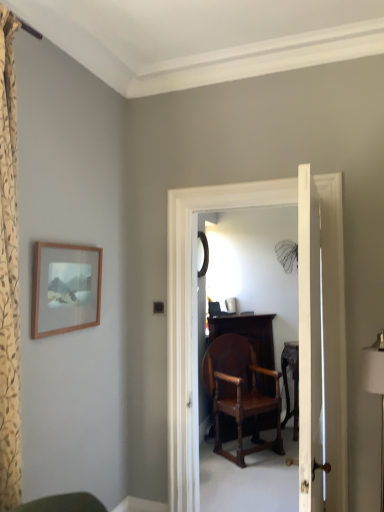
What do you see at coordinates (375, 386) in the screenshot? I see `white fabric lampshade at right` at bounding box center [375, 386].

The image size is (384, 512). Describe the element at coordinates (294, 383) in the screenshot. I see `wooden carved table at center` at that location.

What do you see at coordinates (204, 254) in the screenshot? I see `black glass mirror at center` at bounding box center [204, 254].

You are a GUI agent. You are given a task and a screenshot of the screen. Output one action in this format:
    pyautogui.click(x=<x>, y=<y>)
    Task: Click on the wooden picture frame at upper left
    Image resolution: width=384 pixels, height=512 pixels.
    Given the screenshot: What is the action you would take?
    pyautogui.click(x=65, y=288)

The height and width of the screenshot is (512, 384). I want to click on chair above the wooden carved table at center (from a real-world perspective), so click(241, 395).

Is wooden carved table at center taller than mahogany wood chair at center?

In fact, wooden carved table at center may be shorter than mahogany wood chair at center.

From a real-world perspective, is wooden carved table at center physically below mahogany wood chair at center?

Yes, from a real-world perspective, wooden carved table at center is under mahogany wood chair at center.

Would you say wooden carved table at center is to the left or to the right of mahogany wood chair at center in the picture?

In the image, wooden carved table at center appears on the right side of mahogany wood chair at center.

This screenshot has width=384, height=512. In the image, there is a mahogany wood chair at center. In order to click on table lamp above it (from the image's perspective) in this screenshot , I will do `click(375, 386)`.

Is point (271, 441) positioned in front of point (376, 376)?

That is False.

Considering the relative sizes of mahogany wood chair at center and white fabric lampshade at right in the image provided, is mahogany wood chair at center taller than white fabric lampshade at right?

Yes.

Is mahogany wood chair at center bigger than white fabric lampshade at right?

Indeed, mahogany wood chair at center has a larger size compared to white fabric lampshade at right.

Based on the photo, is white fabric lampshade at right smaller than wooden carved table at center?

Indeed, white fabric lampshade at right has a smaller size compared to wooden carved table at center.

Is wooden carved table at center at the back of white fabric lampshade at right?

No, wooden carved table at center is not at the back of white fabric lampshade at right.

From the image's perspective, which object appears higher, white fabric lampshade at right or wooden carved table at center?

white fabric lampshade at right is shown above in the image.

From a real-world perspective, is white fabric lampshade at right on wooden carved table at center?

Indeed, from a real-world perspective, white fabric lampshade at right stands above wooden carved table at center.

From a real-world perspective, is white wooden door at center located higher than wooden carved table at center?

Yes, from a real-world perspective, white wooden door at center is on top of wooden carved table at center.

Between point (318, 331) and point (294, 429), which one is positioned in front?

Positioned in front is point (318, 331).

Is white wooden door at center positioned with its back to wooden carved table at center?

No, white wooden door at center is not facing away from wooden carved table at center.

From the image's perspective, which is below, white wooden door at center or wooden carved table at center?

From the image's view, wooden carved table at center is below.

What's the angular difference between wooden picture frame at upper left and white wooden door at center's facing directions?

The angular difference between wooden picture frame at upper left and white wooden door at center is 179 degrees.

From the image's perspective, is wooden picture frame at upper left above or below white wooden door at center?

From the image's perspective, wooden picture frame at upper left appears above white wooden door at center.

Is wooden picture frame at upper left facing towards white wooden door at center?

Yes, wooden picture frame at upper left is aimed at white wooden door at center.

Relative to white wooden door at center, is wooden picture frame at upper left in front or behind?

wooden picture frame at upper left is behind white wooden door at center.

Between white wooden door at center and black glass mirror at center, which one appears on the right side from the viewer's perspective?

Positioned to the right is white wooden door at center.

Between white wooden door at center and black glass mirror at center, which one has more height?

white wooden door at center is taller.

Considering the sizes of objects white wooden door at center and black glass mirror at center in the image provided, who is thinner, white wooden door at center or black glass mirror at center?

With smaller width is black glass mirror at center.

Find the location of a particular element. This screenshot has width=384, height=512. chair that is on the right side of black glass mirror at center is located at coordinates (241, 395).

Is mahogany wood chair at center oriented towards black glass mirror at center?

No.

How many degrees apart are the facing directions of mahogany wood chair at center and black glass mirror at center?

They differ by 39.2 degrees in their facing directions.

Can black glass mirror at center be found inside mahogany wood chair at center?

Definitely not — black glass mirror at center is not inside mahogany wood chair at center.

Where is `chair located in front of the wooden carved table at center`? chair located in front of the wooden carved table at center is located at coordinates (241, 395).

Identify the location of chair below the white fabric lampshade at right (from a real-world perspective). (241, 395).

Consider the image. Estimate the real-world distances between objects in this image. Which object is closer to white wooden door at center, black glass mirror at center or white fabric lampshade at right?

white fabric lampshade at right lies closer to white wooden door at center than the other object.

From the image, which object appears to be farther from white wooden door at center, black glass mirror at center or wooden carved table at center?

black glass mirror at center is further to white wooden door at center.

Which object lies nearer to the anchor point white wooden door at center, wooden carved table at center or white fabric lampshade at right?

Among the two, white fabric lampshade at right is located nearer to white wooden door at center.

Consider the image. Which object lies nearer to the anchor point wooden carved table at center, white fabric lampshade at right or mahogany wood chair at center?

Based on the image, mahogany wood chair at center appears to be nearer to wooden carved table at center.

When comparing their distances from wooden picture frame at upper left, does white wooden door at center or mahogany wood chair at center seem closer?

white wooden door at center lies closer to wooden picture frame at upper left than the other object.

When comparing their distances from black glass mirror at center, does white wooden door at center or wooden carved table at center seem further?

white wooden door at center is positioned further to the anchor black glass mirror at center.

Based on the photo, looking at the image, which one is located further to mahogany wood chair at center, white wooden door at center or black glass mirror at center?

Among the two, white wooden door at center is located further to mahogany wood chair at center.

Estimate the real-world distances between objects in this image. Which object is closer to white wooden door at center, wooden picture frame at upper left or white fabric lampshade at right?

Based on the image, white fabric lampshade at right appears to be nearer to white wooden door at center.

Locate an element on the screen. table positioned between white wooden door at center and black glass mirror at center from near to far is located at coordinates (294, 383).

Locate an element on the screen. picture frame between white fabric lampshade at right and wooden carved table at center along the z-axis is located at coordinates (65, 288).

Where is `chair between white wooden door at center and wooden carved table at center along the z-axis`? chair between white wooden door at center and wooden carved table at center along the z-axis is located at coordinates (241, 395).

What are the coordinates of `table lamp between white wooden door at center and mahogany wood chair at center along the z-axis` in the screenshot? It's located at (375, 386).